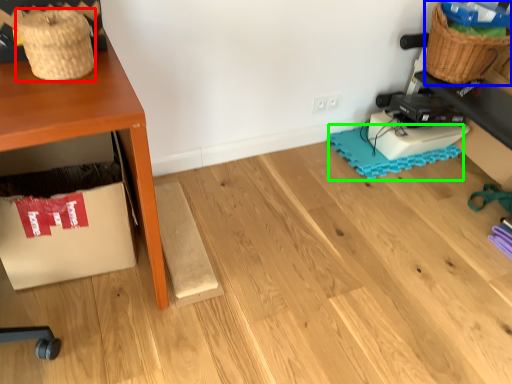
Question: Estimate the real-world distances between objects in this image. Which object is closer to basket (highlighted by a red box), basket (highlighted by a blue box) or mat (highlighted by a green box)?

Choices:
 (A) basket
 (B) mat

Answer: (B)